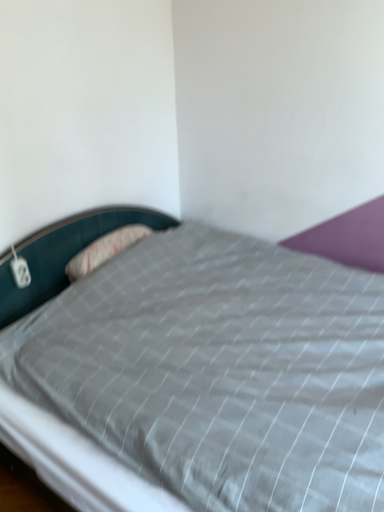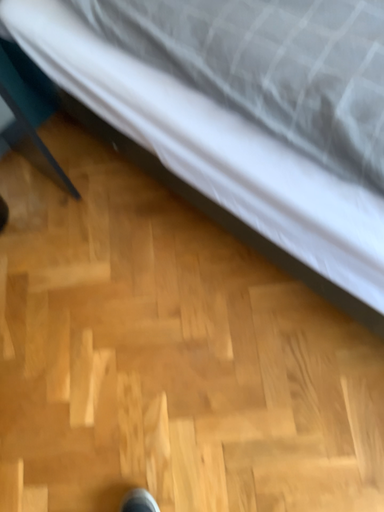
Question: How did the camera likely rotate when shooting the video?

Choices:
 (A) rotated upward
 (B) rotated downward

Answer: (B)